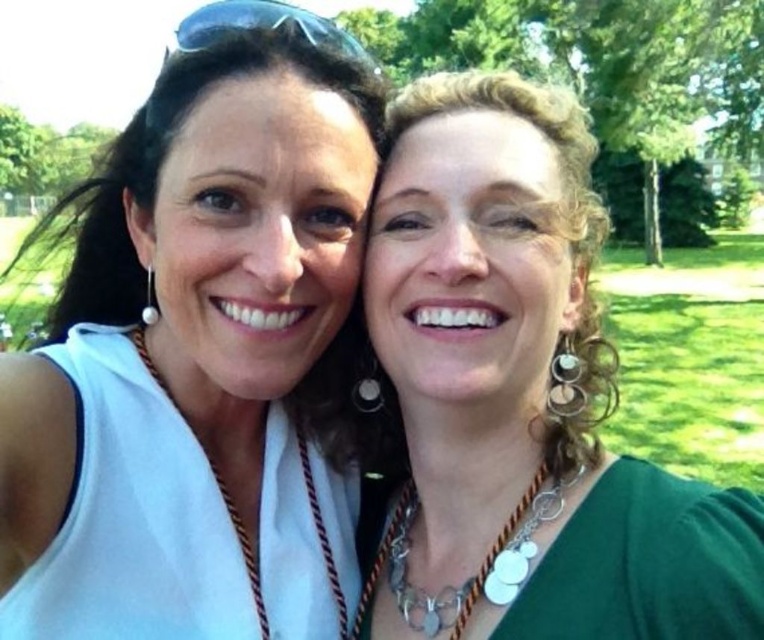
Who is shorter, green matte necklace at center or silver metallic chain at center?

Standing shorter between the two is silver metallic chain at center.

What do you see at coordinates (523, 396) in the screenshot? This screenshot has width=764, height=640. I see `green matte necklace at center` at bounding box center [523, 396].

This screenshot has width=764, height=640. Find the location of `green matte necklace at center`. green matte necklace at center is located at coordinates (523, 396).

Measure the distance between black plastic goggles at upper center and silver metallic chain at center.

A distance of 1.04 meters exists between black plastic goggles at upper center and silver metallic chain at center.

Which of these two, black plastic goggles at upper center or silver metallic chain at center, stands shorter?

silver metallic chain at center is shorter.

The image size is (764, 640). What do you see at coordinates (261, 28) in the screenshot?
I see `black plastic goggles at upper center` at bounding box center [261, 28].

Locate an element on the screen. The height and width of the screenshot is (640, 764). black plastic goggles at upper center is located at coordinates (261, 28).

From the picture: Is white fabric at left closer to camera compared to silver metallic chain at center?

Yes.

Who is higher up, white fabric at left or silver metallic chain at center?

white fabric at left is higher up.

Where is `white fabric at left`? This screenshot has height=640, width=764. white fabric at left is located at coordinates (191, 356).